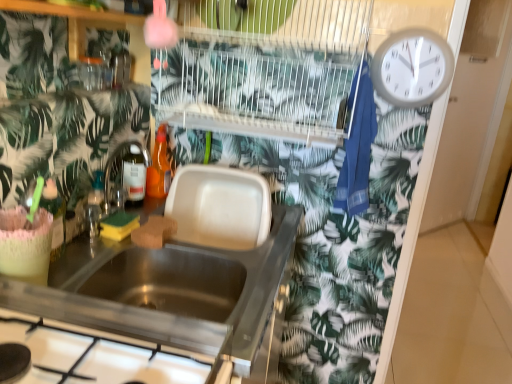
This screenshot has width=512, height=384. What are the coordinates of `empty space that is in between green sponge at sink, positioned as the first food in left-to-right order, and translucent plastic bottle at left, which is the 1th bottle from left to right` in the screenshot? It's located at (91, 249).